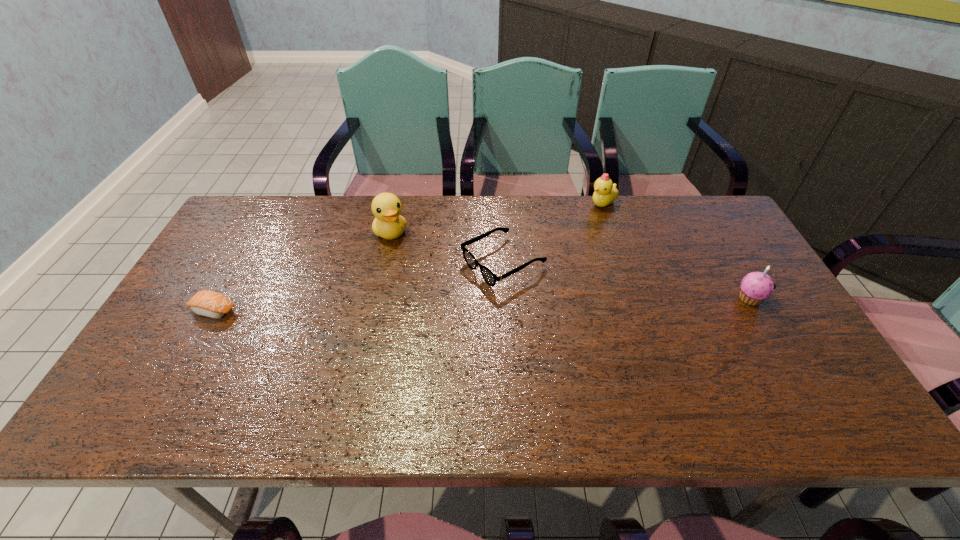
The image size is (960, 540). Find the location of `vacant space located 0.270m on the arms of the fourth tallest object`. vacant space located 0.270m on the arms of the fourth tallest object is located at coordinates (383, 327).

Identify the location of free space located 0.370m on the arms of the fourth tallest object. The image size is (960, 540). (347, 346).

This screenshot has height=540, width=960. In order to click on vacant space situated 0.320m on the arms of the fourth tallest object in this screenshot , I will do `click(365, 336)`.

The image size is (960, 540). I want to click on free space located 0.400m on the face of the duck, so click(x=445, y=341).

At what (x,y) coordinates should I click in order to perform the action: click on vacant space located on the face of the duck. Please return your answer as a coordinate pair (x, y). Looking at the image, I should click on (445, 341).

At what (x,y) coordinates should I click in order to perform the action: click on vacant space located on the face of the duck. Please return your answer as a coordinate pair (x, y). The width and height of the screenshot is (960, 540). Looking at the image, I should click on (420, 292).

You are a GUI agent. You are given a task and a screenshot of the screen. Output one action in this format:
    pyautogui.click(x=<x>, y=<y>)
    Task: Click on the free location located 0.150m on the front-facing side of the duckling
    
    Given the screenshot: What is the action you would take?
    pyautogui.click(x=580, y=235)

The height and width of the screenshot is (540, 960). I want to click on vacant point located 0.060m on the front-facing side of the duckling, so click(590, 220).

Locate an element on the screen. The height and width of the screenshot is (540, 960). free region located on the front-facing side of the duckling is located at coordinates (586, 227).

Find the location of a particular element. The width and height of the screenshot is (960, 540). spectacles located at the far edge is located at coordinates (490, 278).